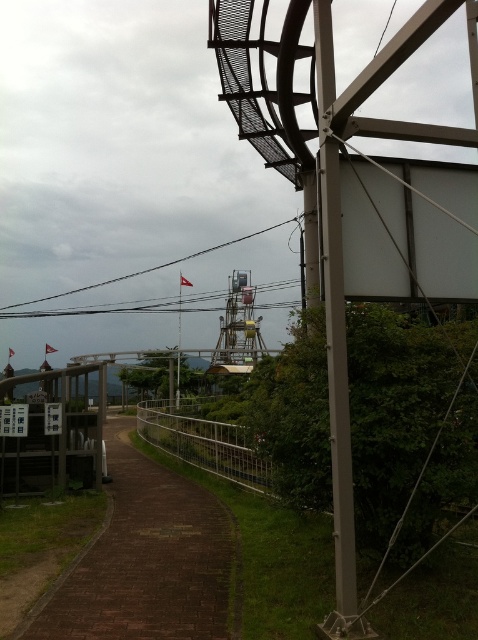
You are standing at the point with coordinates point (43,300) and want to walk to the point with coordinates point (113,602). Which direction should you move to reach your destination?

To reach point (113,602) from point (43,300), you should move forward since point (113,602) is in front of point (43,300).

You are standing on the paved pathway and want to take a photo of both the metallic pole at right and the black wire at center. Which object should you focus on first to ensure both are in clear view?

You should focus on the metallic pole at right first because it is closer to the viewer than the black wire at center, ensuring both will be in clear view when focused properly.

You are standing on the paved pathway and want to reach the metallic pole at right. Based on the coordinates provided in the scene description, can you determine the direction you should walk to reach it?

The metallic pole at right is located at coordinates point (335, 337). Since the pole is at the right side of the pathway, you should walk towards the right to reach it.